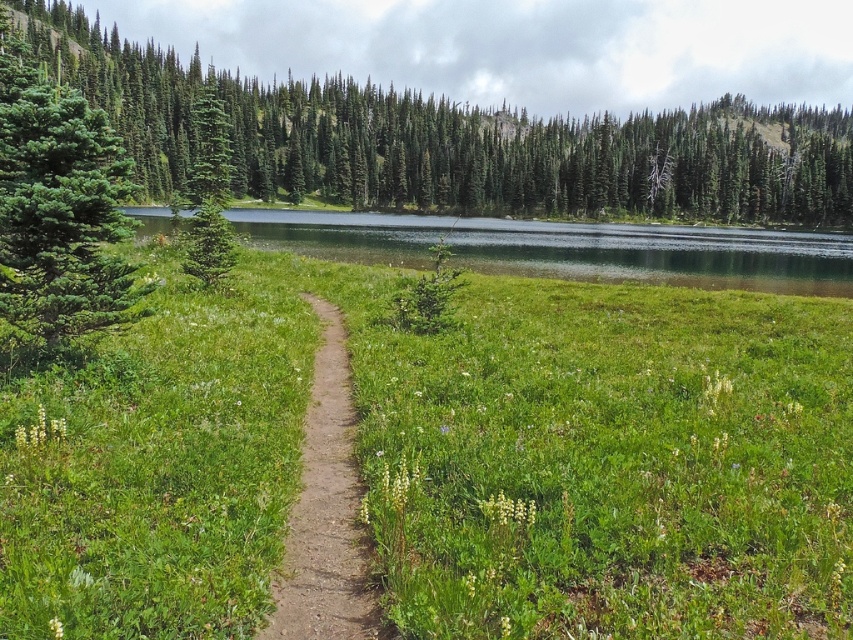
Question: Among these objects, which one is farthest from the camera?

Choices:
 (A) green grassy lake at center
 (B) dirt path at center
 (C) green matte evergreen tree at left

Answer: (A)

Question: Where is green grassy lake at center located in relation to green matte evergreen tree at left in the image?

Choices:
 (A) right
 (B) left

Answer: (A)

Question: Is green textured pine tree at center positioned behind green matte evergreen tree at left?

Choices:
 (A) no
 (B) yes

Answer: (A)

Question: Based on their relative distances, which object is nearer to the green matte tree at left?

Choices:
 (A) green grassy at center
 (B) green textured pine tree at center
 (C) dirt path at center

Answer: (A)

Question: Which point is farther from the camera taking this photo?

Choices:
 (A) (x=288, y=528)
 (B) (x=755, y=372)
 (C) (x=757, y=275)
 (D) (x=309, y=184)

Answer: (D)

Question: Does green matte tree at left have a larger size compared to dirt path at center?

Choices:
 (A) yes
 (B) no

Answer: (A)